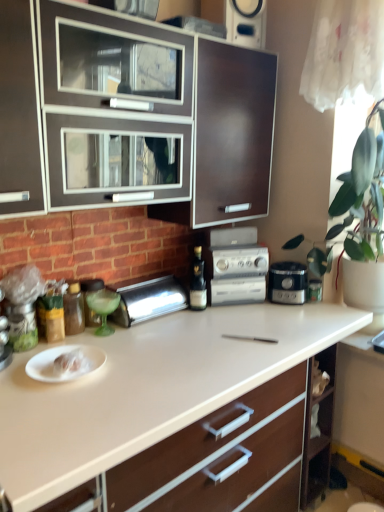
Question: From the image's perspective, does silver metallic breadbox at left, acting as the 2th appliance starting from the front, appear higher than white glossy countertop at center?

Choices:
 (A) no
 (B) yes

Answer: (B)

Question: Considering the relative sizes of silver metallic breadbox at left, which ranks as the second appliance in left-to-right order, and white glossy countertop at center in the image provided, is silver metallic breadbox at left, which ranks as the second appliance in left-to-right order, bigger than white glossy countertop at center?

Choices:
 (A) no
 (B) yes

Answer: (A)

Question: Does silver metallic breadbox at left, acting as the 2th appliance starting from the front, have a greater height compared to white glossy countertop at center?

Choices:
 (A) yes
 (B) no

Answer: (B)

Question: Are silver metallic breadbox at left, which ranks as the second appliance in left-to-right order, and white glossy countertop at center located far from each other?

Choices:
 (A) yes
 (B) no

Answer: (B)

Question: Is white glossy countertop at center a part of silver metallic breadbox at left, which ranks as the 1th appliance in right-to-left order?

Choices:
 (A) yes
 (B) no

Answer: (B)

Question: Is silver metallic breadbox at left, acting as the 2th appliance starting from the front, not within white glossy countertop at center?

Choices:
 (A) yes
 (B) no

Answer: (A)

Question: Is satin black coffee maker at center next to metallic silver spice container at left, which ranks as the second appliance in right-to-left order?

Choices:
 (A) yes
 (B) no

Answer: (B)

Question: Is satin black coffee maker at center to the right of metallic silver spice container at left, the 1th appliance when ordered from front to back, from the viewer's perspective?

Choices:
 (A) yes
 (B) no

Answer: (A)

Question: From the image's perspective, is satin black coffee maker at center above metallic silver spice container at left, the 2th appliance viewed from the back?

Choices:
 (A) no
 (B) yes

Answer: (B)

Question: Can you confirm if satin black coffee maker at center is thinner than metallic silver spice container at left, which ranks as the second appliance in right-to-left order?

Choices:
 (A) no
 (B) yes

Answer: (A)

Question: Can you confirm if satin black coffee maker at center is shorter than metallic silver spice container at left, the 2th appliance viewed from the back?

Choices:
 (A) yes
 (B) no

Answer: (B)

Question: Are satin black coffee maker at center and metallic silver spice container at left, the 1th appliance when ordered from front to back, located far from each other?

Choices:
 (A) yes
 (B) no

Answer: (A)

Question: Does satin black coffee maker at center have a smaller size compared to silver metallic stereo at center?

Choices:
 (A) yes
 (B) no

Answer: (A)